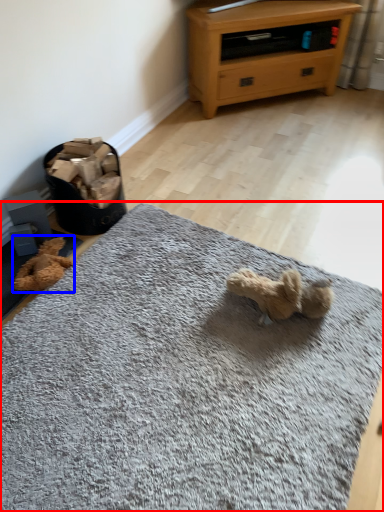
Question: Which object is closer to the camera taking this photo, mat (highlighted by a red box) or teddy (highlighted by a blue box)?

Choices:
 (A) mat
 (B) teddy

Answer: (A)